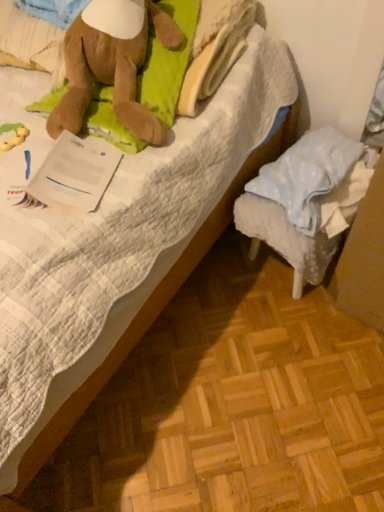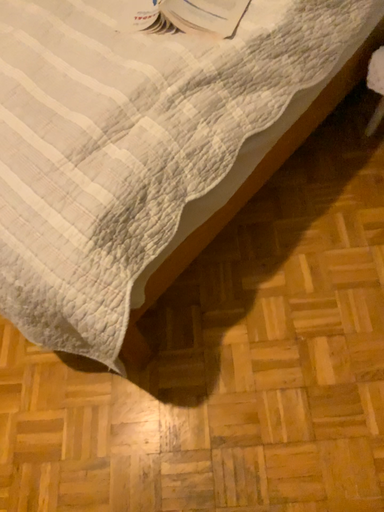
Question: How did the camera likely rotate when shooting the video?

Choices:
 (A) rotated upward
 (B) rotated downward

Answer: (B)